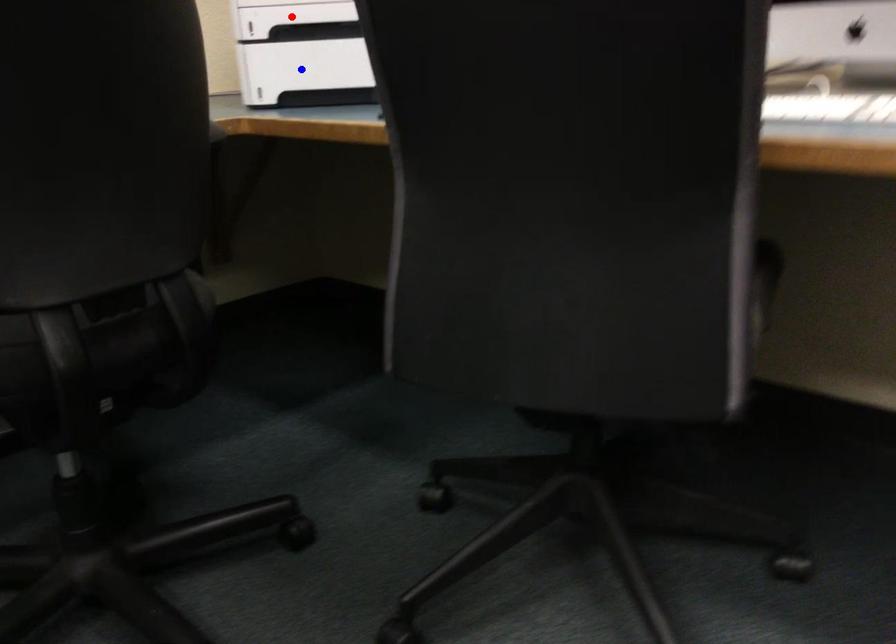
Question: Which of the two points in the image is closer to the camera?

Choices:
 (A) Blue point is closer.
 (B) Red point is closer.

Answer: (B)